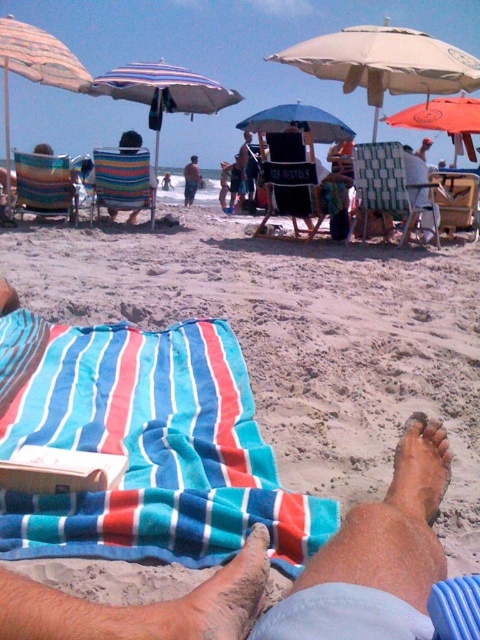
The width and height of the screenshot is (480, 640). Describe the element at coordinates (392, 531) in the screenshot. I see `striped towel at lower center` at that location.

Is point (420, 563) behind point (444, 180)?

No, (420, 563) is in front of (444, 180).

Does point (415, 420) come farther from viewer compared to point (470, 196)?

No, (415, 420) is in front of (470, 196).

Where is `striped towel at lower center`? striped towel at lower center is located at coordinates (392, 531).

Which is behind, point (295, 582) or point (49, 161)?

The point (49, 161) is behind.

Can you confirm if striped towel at lower center is smaller than striped fabric beach chair at left?

Indeed, striped towel at lower center has a smaller size compared to striped fabric beach chair at left.

Between point (412, 536) and point (44, 193), which one is positioned behind?

Point (44, 193)

You are a GUI agent. You are given a task and a screenshot of the screen. Output one action in this format:
    pyautogui.click(x=<x>, y=<y>)
    Task: Click on the striped towel at lower center
    The height and width of the screenshot is (640, 480).
    Given the screenshot: What is the action you would take?
    pos(392,531)

From the picture: Can you confirm if green woven beach chair at center is thinner than blue striped towel at lower left?

No, green woven beach chair at center is not thinner than blue striped towel at lower left.

Is point (393, 204) farther from viewer compared to point (251, 545)?

That is True.

Consider the image. Measure the distance between point (x=384, y=147) and camera.

A distance of 6.83 meters exists between point (x=384, y=147) and camera.

Locate an element on the screen. The image size is (480, 640). green woven beach chair at center is located at coordinates [394, 186].